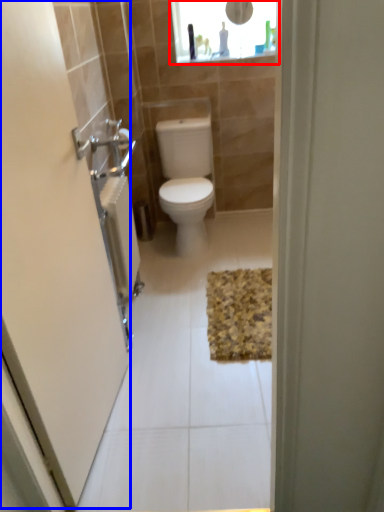
Question: Which object appears farthest to the camera in this image, medicine cabinet (highlighted by a red box) or screen door (highlighted by a blue box)?

Choices:
 (A) medicine cabinet
 (B) screen door

Answer: (A)